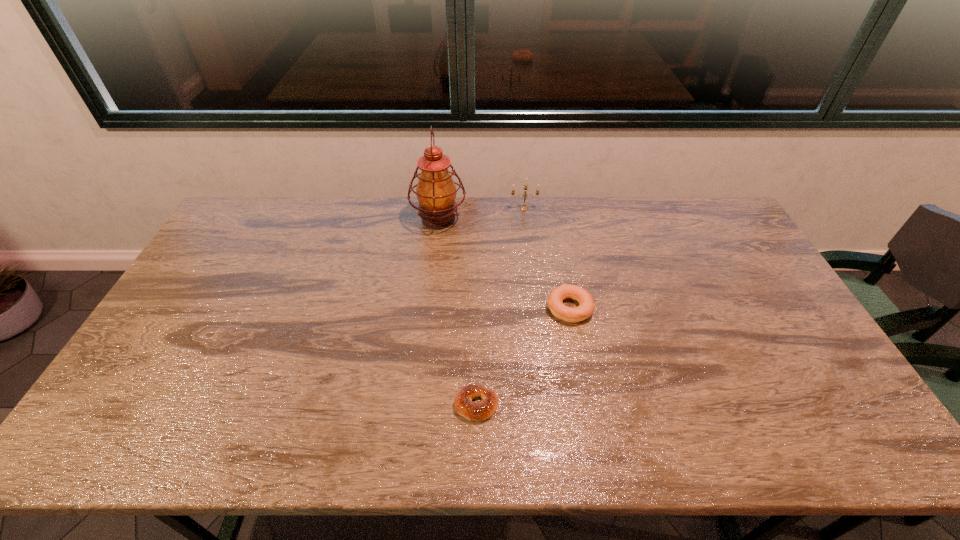
The height and width of the screenshot is (540, 960). Identify the location of unoccupied position between the left bagel and the second tallest object. (500, 307).

You are a GUI agent. You are given a task and a screenshot of the screen. Output one action in this format:
    pyautogui.click(x=<x>, y=<y>)
    Task: Click on the unoccupied area between the third tallest object and the candle
    Image resolution: width=960 pixels, height=540 pixels.
    Given the screenshot: What is the action you would take?
    546,258

Identify the location of vacant space in between the third tallest object and the oil lamp. (504, 264).

Locate an element on the screen. The width and height of the screenshot is (960, 540). free space between the second nearest object and the nearest object is located at coordinates (523, 356).

This screenshot has width=960, height=540. Identify the location of vacant area that lies between the left bagel and the second tallest object. (500, 307).

This screenshot has width=960, height=540. Identify the location of vacant region between the nearest object and the candle. (500, 307).

The width and height of the screenshot is (960, 540). I want to click on free point between the oil lamp and the right bagel, so click(504, 264).

Locate an element on the screen. Image resolution: width=960 pixels, height=540 pixels. empty space that is in between the tallest object and the right bagel is located at coordinates (504, 264).

Locate which object is the third closest to the third shortest object. Please provide its 2D coordinates. Your answer should be formatted as a tuple, i.e. [(x, y)], where the tuple contains the x and y coordinates of a point satisfying the conditions above.

[(463, 404)]

The height and width of the screenshot is (540, 960). I want to click on object that stands as the third closest to the tallest object, so click(463, 404).